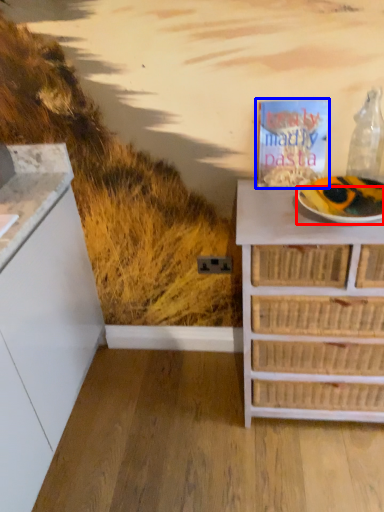
Question: Which object is further to the camera taking this photo, paper plate (highlighted by a red box) or magazine (highlighted by a blue box)?

Choices:
 (A) paper plate
 (B) magazine

Answer: (B)